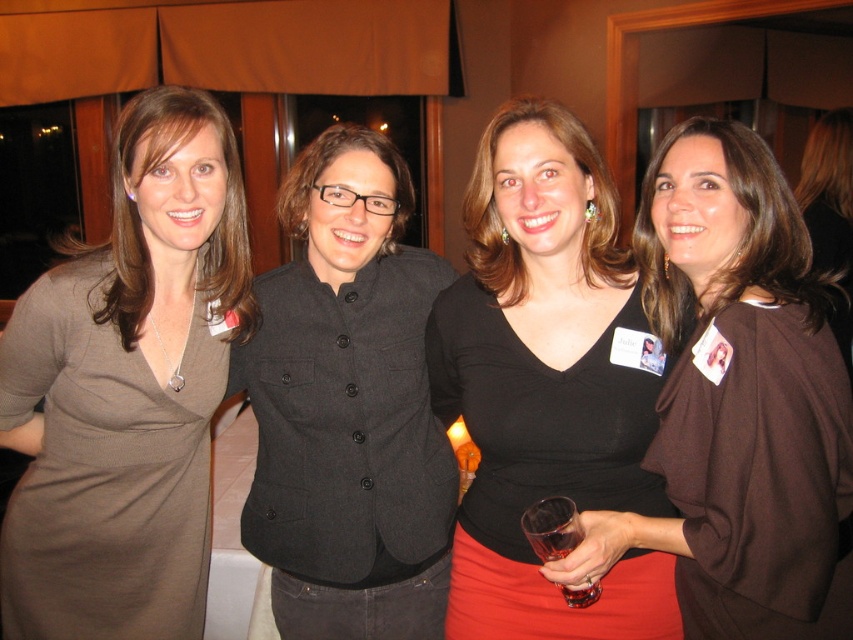
You are a photographer standing 2 meters away from the group of women. You want to take a photo of the matte brown dress at left and ensure that the person next to it is also in focus. Given that your camera has a depth of field that can cover 1.2 meters, will both subjects be in focus?

The distance between the matte brown dress at left and the person next to it is 1.30 meters. Since the camera can only cover 1.2 meters, the person next to the matte brown dress at left will be slightly out of focus.

You are standing in the room and want to locate the brown matte dress at center. According to the coordinates provided, where should you look?

You should look at point (738, 401) to find the brown matte dress at center.